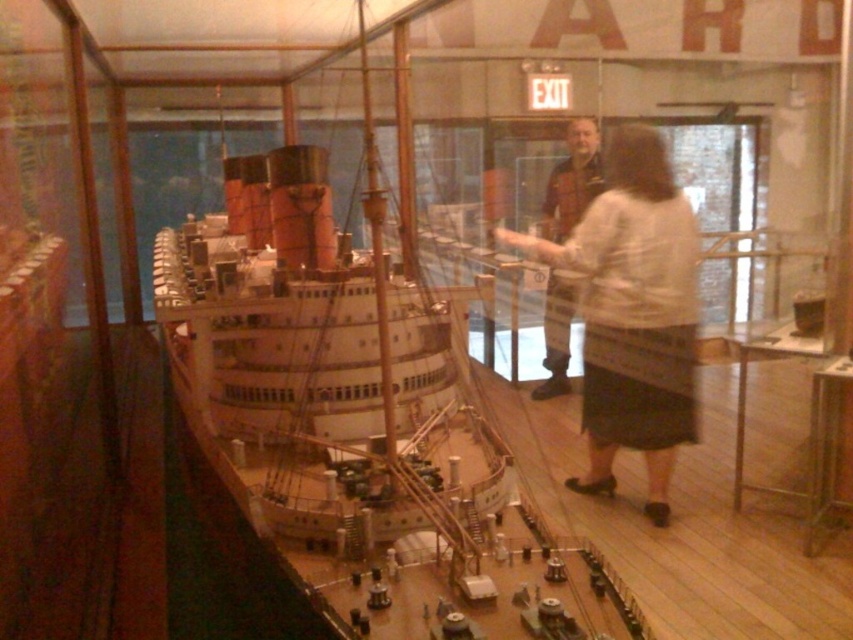
You are a security guard in the museum and you need to locate the white textured sweater at center. According to the coordinates provided, where would you find it?

The white textured sweater at center is located at point coordinates (633, 314).

From the picture: You are a visitor in the museum and you want to sit on the polished wood floor at center to take a closer look at the ship model. However, you notice the white textured sweater at center is already placed there. Can you sit there without moving the sweater?

The white textured sweater at center has a larger size compared to polished wood floor at center, so the sweater might cover a significant portion of the floor area. Moving the sweater or choosing another spot might be necessary to sit comfortably.

You are a visitor in the museum and want to take a photo of the white textured sweater at center without getting too close. You have a camera with a zoom lens. What is the minimum distance you need to maintain to capture the sweater in full frame?

The white textured sweater at center and camera are 4.19 meters apart from each other. To capture the sweater in full frame without moving closer, you should stay at least 4.19 meters away.